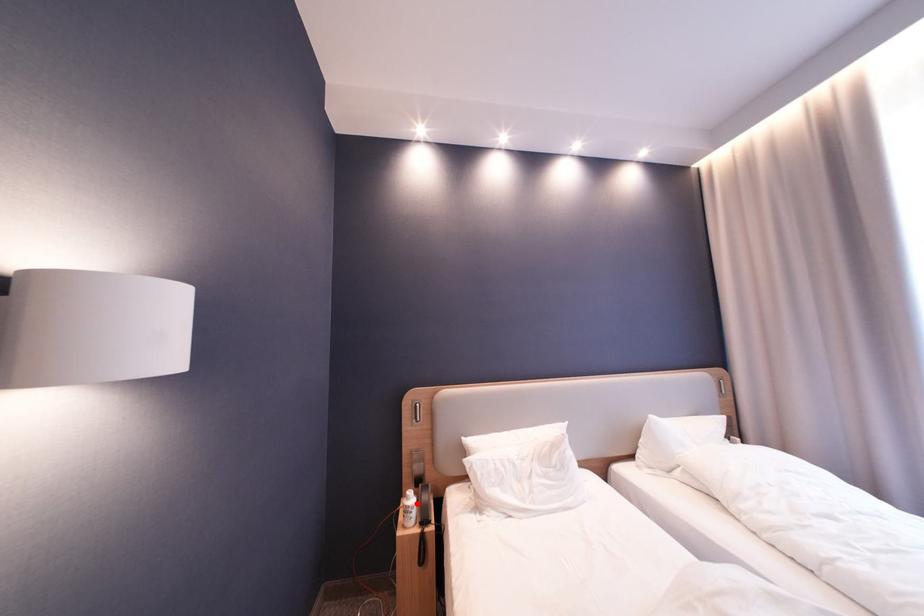
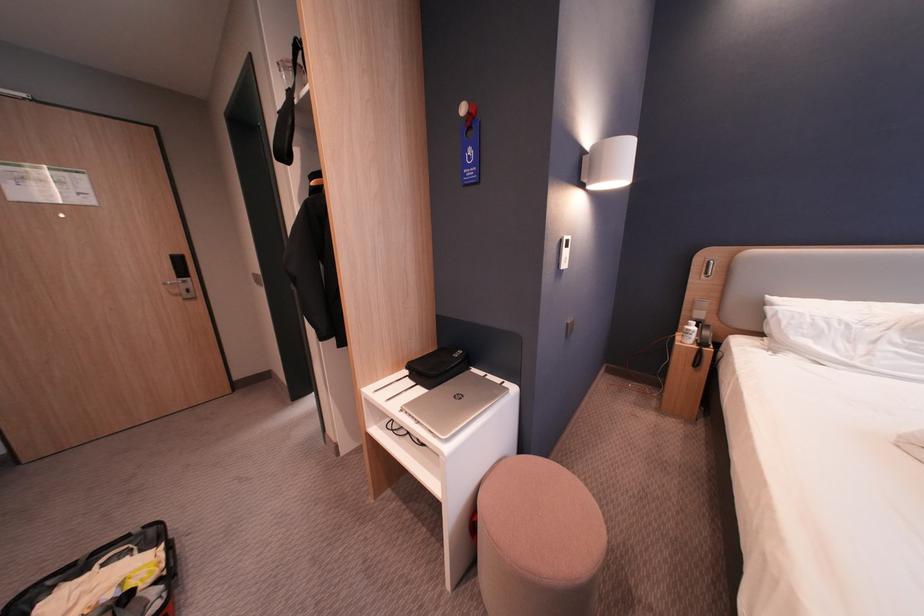
Question: I am providing you with two images of the same scene from different viewpoints. A red point is shown in image1. For the corresponding object point in image2, is it positioned nearer or farther from the camera?

Choices:
 (A) Nearer
 (B) Farther

Answer: (A)